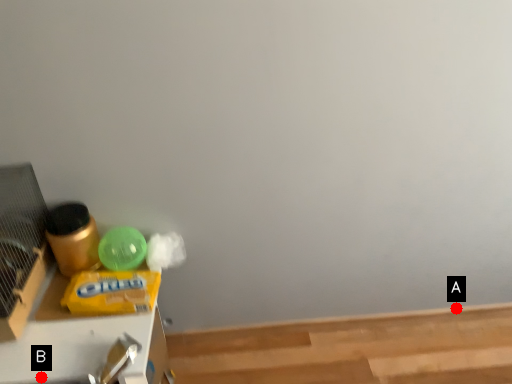
Question: Two points are circled on the image, labeled by A and B beside each circle. Which point is farther from the camera taking this photo?

Choices:
 (A) A is further
 (B) B is further

Answer: (A)